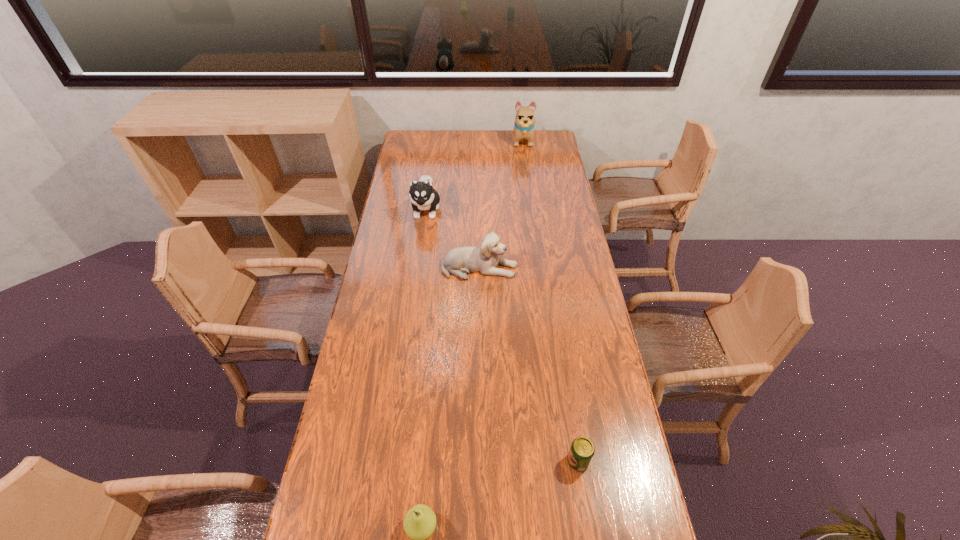
What are the coordinates of `the farthest puppy` in the screenshot? It's located at (524, 123).

Locate an element on the screen. The image size is (960, 540). the rightmost puppy is located at coordinates (524, 123).

Locate an element on the screen. This screenshot has width=960, height=540. the second farthest puppy is located at coordinates click(423, 196).

Locate an element on the screen. Image resolution: width=960 pixels, height=540 pixels. the second tallest object is located at coordinates (423, 196).

This screenshot has height=540, width=960. I want to click on the third nearest object, so [x=460, y=261].

Locate an element on the screen. the third tallest object is located at coordinates (460, 261).

At what (x,y) coordinates should I click in order to perform the action: click on the second nearest object. Please return your answer as a coordinate pair (x, y). Looking at the image, I should click on (582, 450).

The image size is (960, 540). Find the location of `beer can`. beer can is located at coordinates (582, 450).

Locate an element on the screen. vacant region located 0.190m on the face of the tallest object is located at coordinates (527, 169).

Where is `vacant area situated 0.400m at the face of the fourth shortest object`? vacant area situated 0.400m at the face of the fourth shortest object is located at coordinates (414, 296).